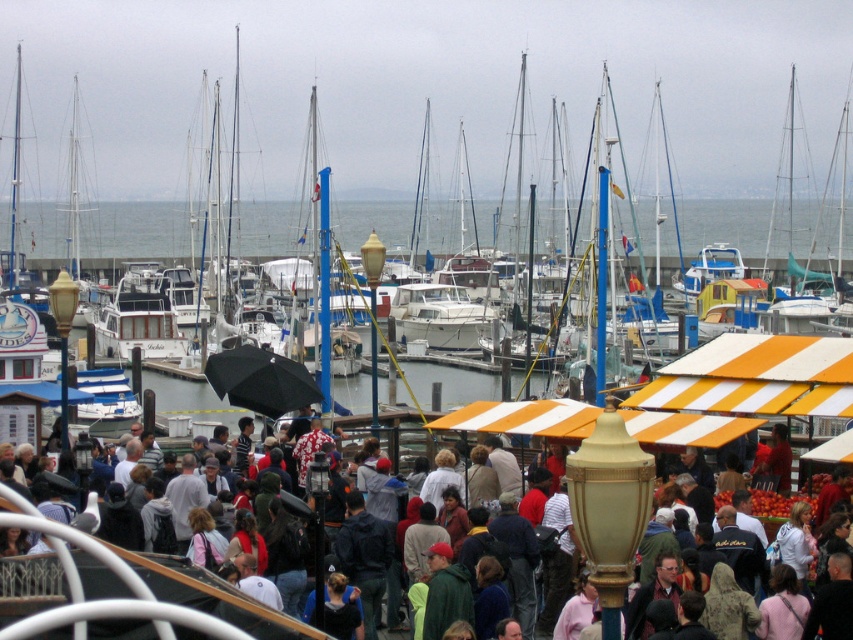
You are a photographer standing at the edge of the marina, wanting to capture a photo that includes both the white glossy boat at center and the multicolored fabric crowd at center. Considering their heights, which one will appear larger in the photo?

The white glossy boat at center will appear larger in the photo because it is much taller than the multicolored fabric crowd at center.

You are a photographer trying to capture a wide shot of the marina scene. You notice the white glossy boat at center and the multicolored fabric crowd at center. Based on their sizes, which one do you think would appear larger in your photo?

The white glossy boat at center might be wider than multicolored fabric crowd at center, so it would likely appear larger in the photo.